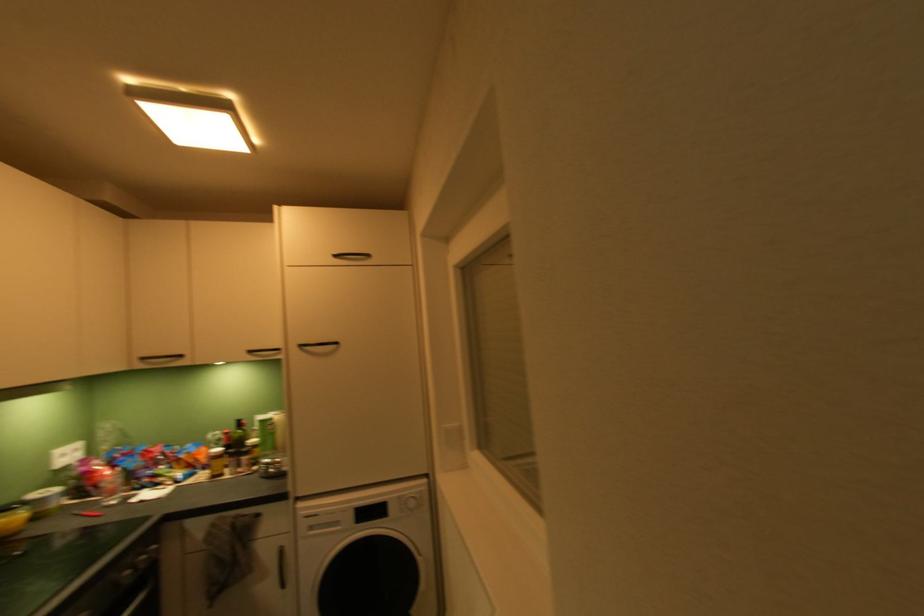
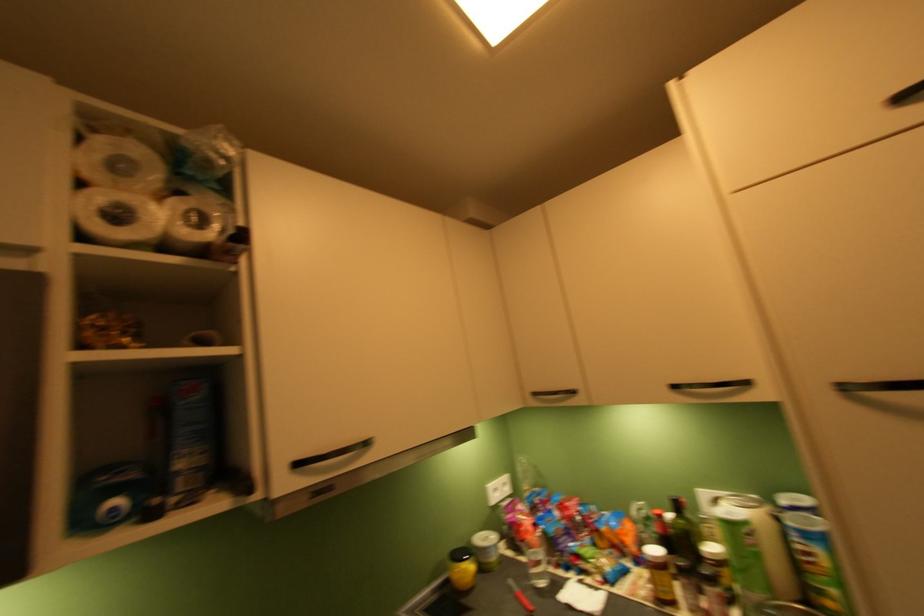
Where in the second image is the point corresponding to pixel 155 362 from the first image?

(546, 398)